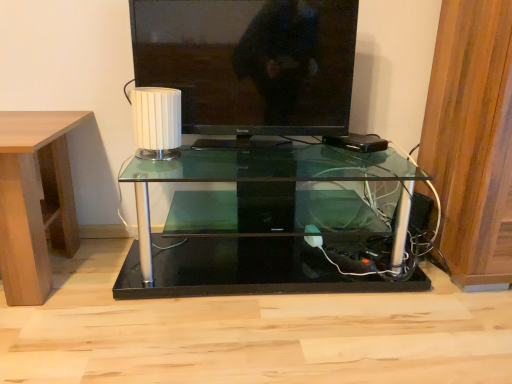
Question: From the image's perspective, is light brown wood at left located above or below transparent glass table at center?

Choices:
 (A) below
 (B) above

Answer: (B)

Question: Is light brown wood at left bigger or smaller than transparent glass table at center?

Choices:
 (A) big
 (B) small

Answer: (B)

Question: Based on their relative distances, which object is nearer to the light brown wood at left?

Choices:
 (A) white ribbed lampshade at center
 (B) transparent glass table at center
 (C) matte black television at upper center

Answer: (A)

Question: Which is farther from the light brown wood at left?

Choices:
 (A) matte black television at upper center
 (B) white ribbed lampshade at center
 (C) transparent glass table at center

Answer: (C)